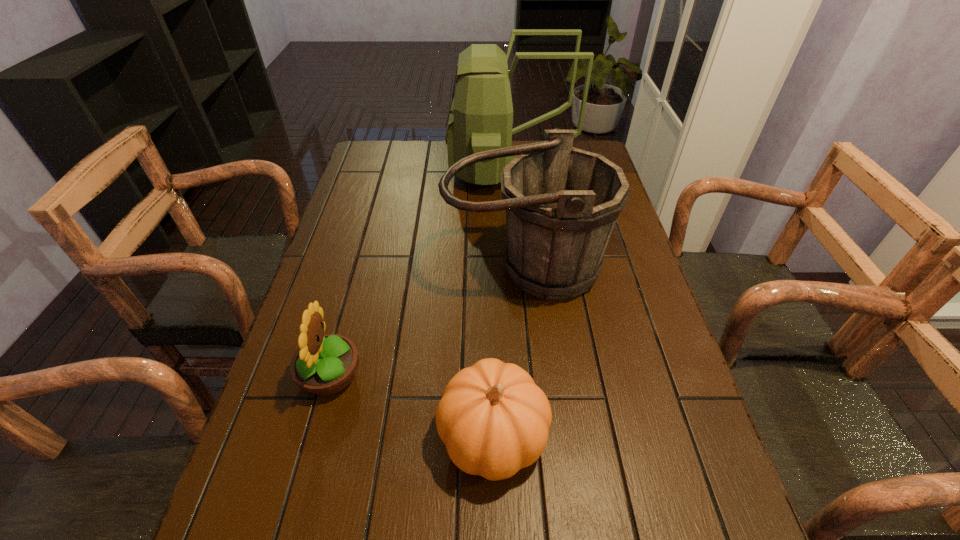
Where is `free spot between the leftmost object and the second farthest object`? The width and height of the screenshot is (960, 540). free spot between the leftmost object and the second farthest object is located at coordinates (427, 322).

Find the location of a particular element. This screenshot has width=960, height=540. vacant region between the bucket and the leftmost object is located at coordinates point(427,322).

Identify the location of free point between the bucket and the pumpkin. (509, 352).

Locate an element on the screen. The width and height of the screenshot is (960, 540). vacant area between the pumpkin and the second farthest object is located at coordinates (509, 352).

I want to click on free space between the pumpkin and the backpack, so click(500, 303).

Where is `vacant region between the leftmost object and the bucket`? vacant region between the leftmost object and the bucket is located at coordinates (427, 322).

This screenshot has height=540, width=960. In order to click on free space that is in between the sunflower and the farthest object in this screenshot , I will do `click(419, 273)`.

Identify the location of free spot between the sunflower and the bucket. The width and height of the screenshot is (960, 540). (427, 322).

Where is `free point between the sunflower and the pumpkin`? This screenshot has height=540, width=960. free point between the sunflower and the pumpkin is located at coordinates (412, 406).

Identify the location of the closest object to the sunflower. (494, 420).